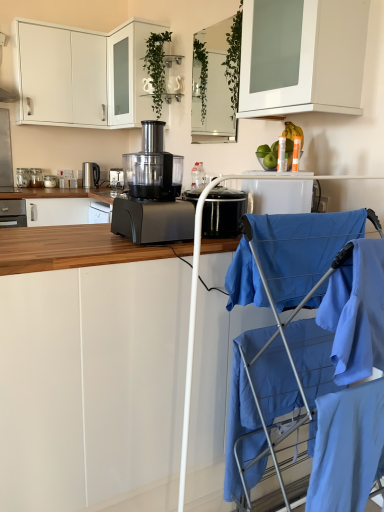
What are the coordinates of `blank space to the left of black plastic food processor at center, placed as the 2th kitchen appliance when sorted from right to left` in the screenshot? It's located at (65, 237).